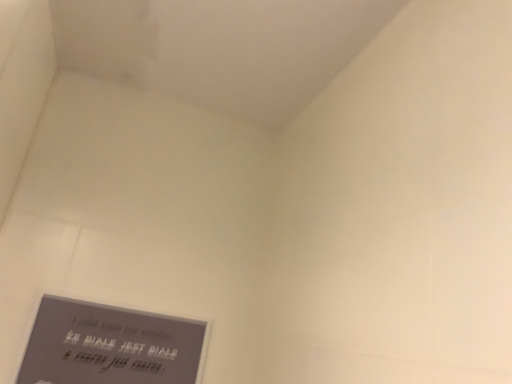
Image resolution: width=512 pixels, height=384 pixels. What do you see at coordinates (109, 345) in the screenshot?
I see `matte gray sign at lower left` at bounding box center [109, 345].

Locate an element on the screen. The height and width of the screenshot is (384, 512). matte gray sign at lower left is located at coordinates (109, 345).

Locate an element on the screen. The width and height of the screenshot is (512, 384). matte gray sign at lower left is located at coordinates (109, 345).